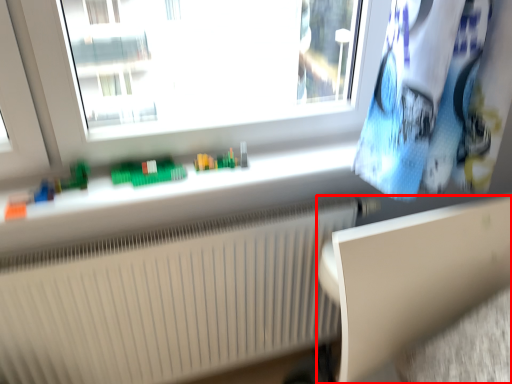
Question: From the image's perspective, considering the relative positions of table (annotated by the red box) and radiator in the image provided, where is table (annotated by the red box) located with respect to the staircase?

Choices:
 (A) above
 (B) below

Answer: (A)